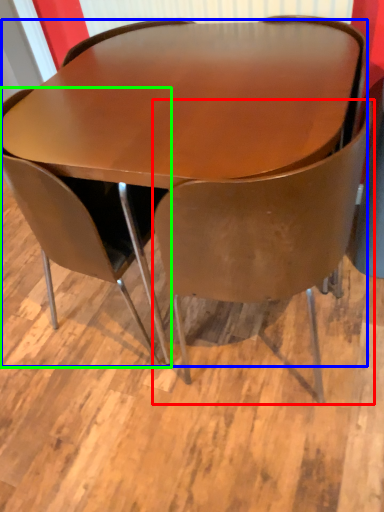
Question: Which object is the farthest from chair (highlighted by a red box)? Choose among these: table (highlighted by a blue box) or chair (highlighted by a green box).

Choices:
 (A) table
 (B) chair

Answer: (B)